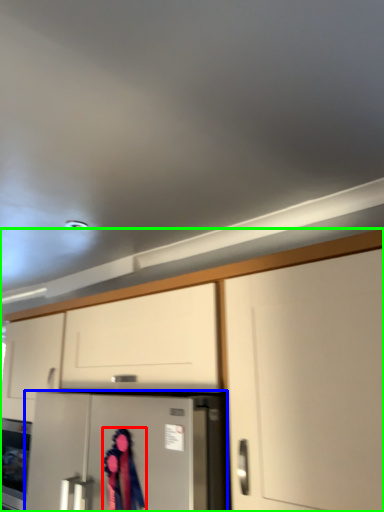
Question: Based on their relative distances, which object is nearer to woman (highlighted by a red box)? Choose from refrigerator (highlighted by a blue box) and cabinetry (highlighted by a green box).

Choices:
 (A) refrigerator
 (B) cabinetry

Answer: (A)